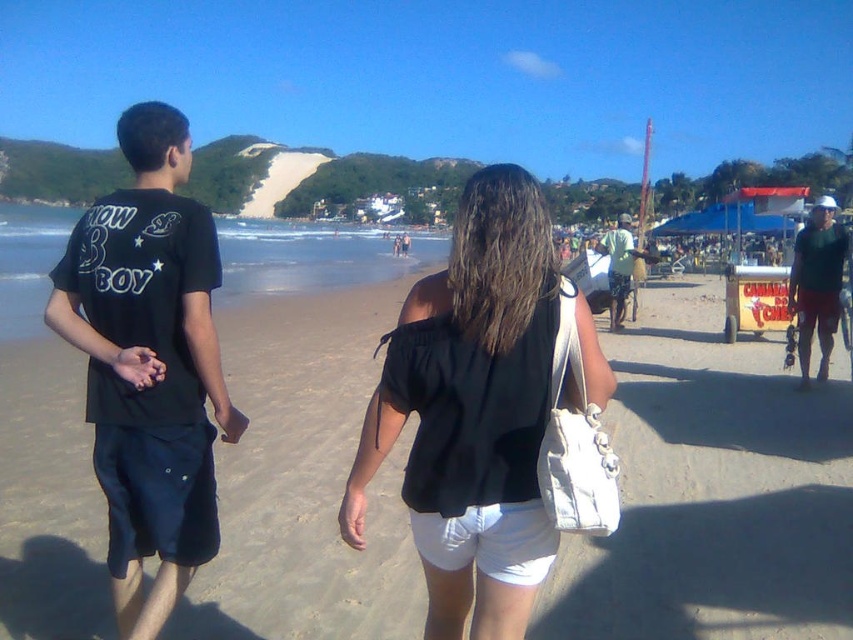
Can you confirm if white fabric bag at center is positioned to the left of green fabric shirt at center?

Yes, white fabric bag at center is to the left of green fabric shirt at center.

Does white fabric bag at center have a greater height compared to green fabric shirt at center?

No.

Between point (7, 620) and point (618, 273), which one is positioned in front?

Point (7, 620) is in front.

Locate an element on the screen. Image resolution: width=853 pixels, height=640 pixels. white fabric bag at center is located at coordinates (712, 492).

Who is more forward, (827, 196) or (608, 278)?

Point (608, 278) is in front.

Is matte black shirt at right to the left of green fabric shirt at center from the viewer's perspective?

In fact, matte black shirt at right is to the right of green fabric shirt at center.

Locate an element on the screen. matte black shirt at right is located at coordinates (817, 284).

Does white canvas bag at center have a larger size compared to black matte shirt at center?

Actually, white canvas bag at center might be smaller than black matte shirt at center.

Is point (550, 563) in front of point (393, 236)?

That is True.

You are a GUI agent. You are given a task and a screenshot of the screen. Output one action in this format:
    pyautogui.click(x=<x>, y=<y>)
    Task: Click on the white canvas bag at center
    The height and width of the screenshot is (640, 853).
    Given the screenshot: What is the action you would take?
    pyautogui.click(x=477, y=410)